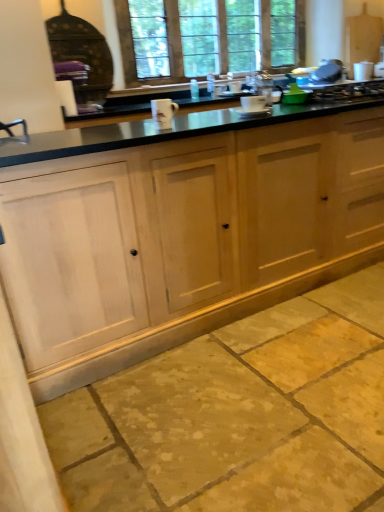
Question: Is white ceramic mug at center, marked as the second appliance in a right-to-left arrangement, positioned in front of white ceramic mug at center, the 1th appliance in the right-to-left sequence?

Choices:
 (A) yes
 (B) no

Answer: (A)

Question: From the image's perspective, is white ceramic mug at center, which is counted as the first appliance, starting from the left, below white ceramic mug at center, the second appliance in the front-to-back sequence?

Choices:
 (A) no
 (B) yes

Answer: (B)

Question: From the image's perspective, is white ceramic mug at center, acting as the second appliance starting from the back, on top of white ceramic mug at center, the second appliance in the front-to-back sequence?

Choices:
 (A) no
 (B) yes

Answer: (A)

Question: Is white ceramic mug at center, which is the 2th appliance from top to bottom, behind white ceramic mug at center, placed as the 1th appliance when sorted from back to front?

Choices:
 (A) yes
 (B) no

Answer: (B)

Question: Considering the relative sizes of white ceramic mug at center, acting as the second appliance starting from the back, and white ceramic mug at center, the 1th appliance in the right-to-left sequence, in the image provided, is white ceramic mug at center, acting as the second appliance starting from the back, taller than white ceramic mug at center, the 1th appliance in the right-to-left sequence,?

Choices:
 (A) yes
 (B) no

Answer: (A)

Question: From a real-world perspective, is white ceramic mug at center, marked as the second appliance in a right-to-left arrangement, below white ceramic mug at center, the 1th appliance in the right-to-left sequence?

Choices:
 (A) no
 (B) yes

Answer: (A)

Question: From a real-world perspective, is white ceramic mug at center, which is the second appliance from left to right, on natural stone floor at lower center?

Choices:
 (A) no
 (B) yes

Answer: (B)

Question: Considering the relative positions of white ceramic mug at center, which is the second appliance from left to right, and natural stone floor at lower center in the image provided, is white ceramic mug at center, which is the second appliance from left to right, behind natural stone floor at lower center?

Choices:
 (A) yes
 (B) no

Answer: (A)

Question: Is natural stone floor at lower center completely or partially inside white ceramic mug at center, the second appliance in the front-to-back sequence?

Choices:
 (A) no
 (B) yes

Answer: (A)

Question: Can you confirm if white ceramic mug at center, which is the second appliance from left to right, is thinner than natural stone floor at lower center?

Choices:
 (A) no
 (B) yes

Answer: (B)

Question: Does white ceramic mug at center, placed as the 1th appliance when sorted from top to bottom, have a smaller size compared to natural stone floor at lower center?

Choices:
 (A) yes
 (B) no

Answer: (A)

Question: Is the position of white ceramic mug at center, placed as the 1th appliance when sorted from back to front, less distant than that of natural stone floor at lower center?

Choices:
 (A) no
 (B) yes

Answer: (A)

Question: Is metallic silver gas stove at upper right completely or partially inside natural wood cabinets at center?

Choices:
 (A) no
 (B) yes

Answer: (B)